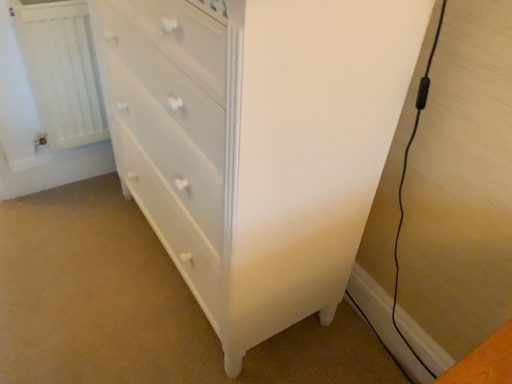
Question: Considering the positions of point (125, 84) and point (35, 67), is point (125, 84) closer or farther from the camera than point (35, 67)?

Choices:
 (A) closer
 (B) farther

Answer: (A)

Question: Considering the positions of white painted wood chest of drawers at center and white painted radiator at left in the image, is white painted wood chest of drawers at center taller or shorter than white painted radiator at left?

Choices:
 (A) short
 (B) tall

Answer: (B)

Question: From the image's perspective, is white painted wood chest of drawers at center located above or below white painted radiator at left?

Choices:
 (A) above
 (B) below

Answer: (B)

Question: Is white painted radiator at left in front of or behind white painted wood chest of drawers at center in the image?

Choices:
 (A) behind
 (B) front

Answer: (A)

Question: Visually, is white painted radiator at left positioned to the left or to the right of white painted wood chest of drawers at center?

Choices:
 (A) right
 (B) left

Answer: (B)

Question: From a real-world perspective, is white painted radiator at left positioned above or below white painted wood chest of drawers at center?

Choices:
 (A) below
 (B) above

Answer: (A)

Question: From the image's perspective, is white painted radiator at left above or below white painted wood chest of drawers at center?

Choices:
 (A) below
 (B) above

Answer: (B)